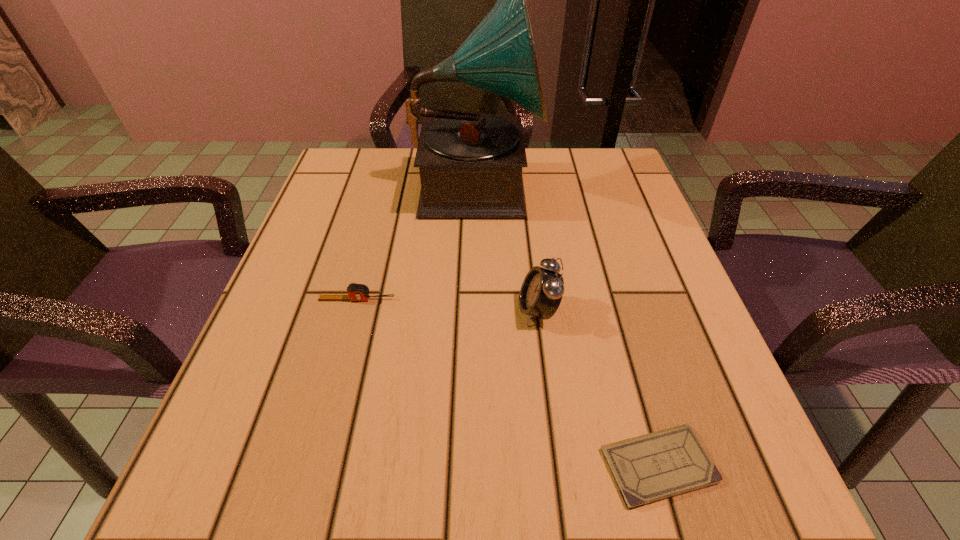
Where is `free space between the farthest object and the second shortest object`? The image size is (960, 540). free space between the farthest object and the second shortest object is located at coordinates (417, 242).

Image resolution: width=960 pixels, height=540 pixels. Find the location of `blank region between the tape measure and the nearest object`. blank region between the tape measure and the nearest object is located at coordinates (508, 382).

Identify the location of free point between the shortest object and the record player. The image size is (960, 540). (567, 325).

This screenshot has width=960, height=540. Find the location of `vacant space that's between the record player and the rightmost object`. vacant space that's between the record player and the rightmost object is located at coordinates (567, 325).

You are a GUI agent. You are given a task and a screenshot of the screen. Output one action in this format:
    pyautogui.click(x=<x>, y=<y>)
    Task: Click on the object that can be found as the second closest to the alarm clock
    The width and height of the screenshot is (960, 540).
    Given the screenshot: What is the action you would take?
    pyautogui.click(x=470, y=164)

Find the location of a particular element. Image resolution: width=960 pixels, height=540 pixels. object that is the closest to the alarm clock is located at coordinates (648, 468).

Find the location of a particular element. The image size is (960, 540). vacant space that satisfies the following two spatial constraints: 1. on the front side of the second shortest object; 2. on the left side of the nearest object is located at coordinates (313, 465).

Where is `blank space that satisfies the following two spatial constraints: 1. on the face of the alarm clock; 2. on the right side of the shortest object`? This screenshot has height=540, width=960. blank space that satisfies the following two spatial constraints: 1. on the face of the alarm clock; 2. on the right side of the shortest object is located at coordinates (557, 465).

Identify the location of vacant position in the image that satisfies the following two spatial constraints: 1. on the face of the second tallest object; 2. on the left side of the checkbook. (557, 465).

Identify the location of vacant space that satisfies the following two spatial constraints: 1. on the horn of the rightmost object; 2. on the right side of the farthest object. (473, 465).